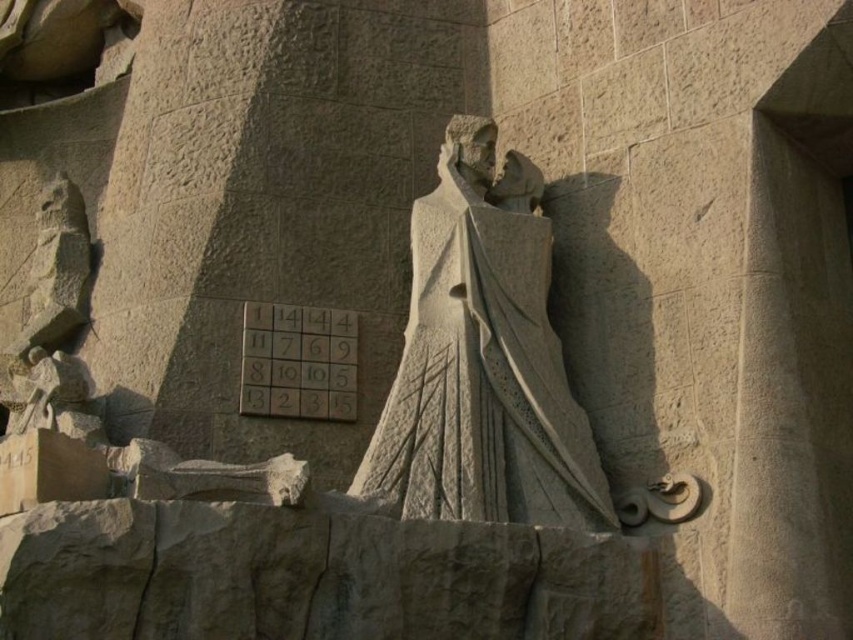
You are an architect inspecting the stone wall and need to install a protective cover over the stone statue at center and the matte stone plaque at center. Which object requires a taller cover to accommodate its height?

The stone statue at center requires a taller cover because it has a greater height compared to the matte stone plaque at center.

You are an archaeologist examining the stone wall. You notice a point marked at coordinates (x=482, y=360). What does this point indicate?

The point at coordinates (x=482, y=360) indicates the location of the stone statue at center.